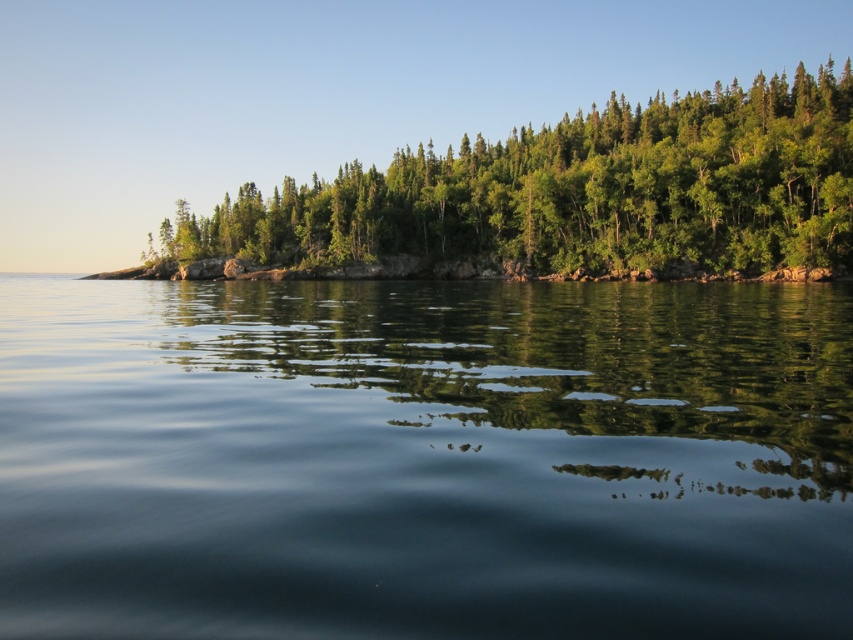
You are standing at the lakeside and want to take a photo of the green leafy trees at upper center and the transparent water at center. Which object will appear closer to the camera in the photo?

The transparent water at center will appear closer to the camera in the photo because it is shorter than the green leafy trees at upper center, making it positioned nearer to the observer.

You are standing at the edge of the water and see the point labeled as point (424, 460). What is the object located at that coordinate?

The point (424, 460) corresponds to transparent water at center.